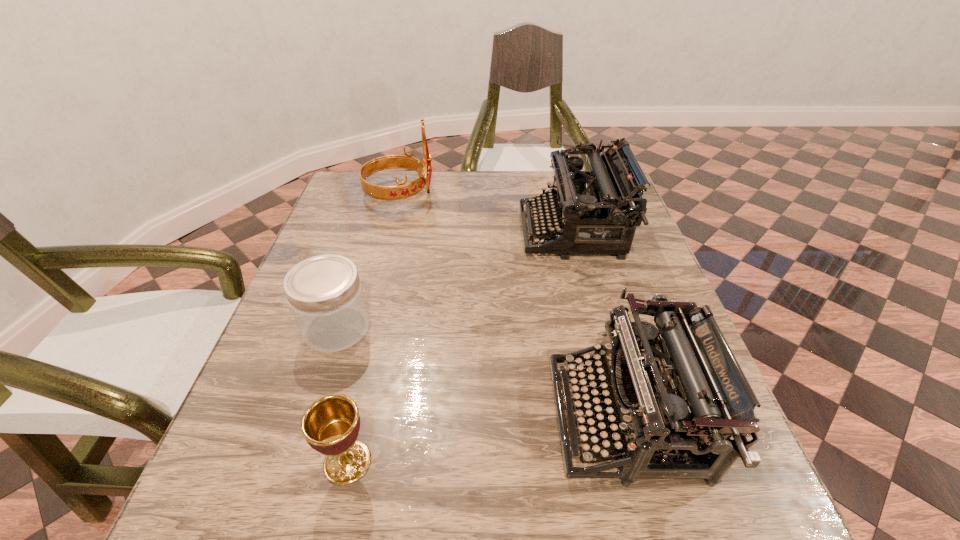
Locate an element on the screen. The height and width of the screenshot is (540, 960). tiara is located at coordinates (404, 190).

Image resolution: width=960 pixels, height=540 pixels. I want to click on the farther typewriter, so click(x=592, y=210).

Locate an element on the screen. This screenshot has width=960, height=540. the shorter typewriter is located at coordinates (685, 395).

Locate an element on the screen. The image size is (960, 540). the third shortest object is located at coordinates (685, 395).

At what (x,y) coordinates should I click in order to perform the action: click on jar. Please return your answer as a coordinate pair (x, y). The height and width of the screenshot is (540, 960). Looking at the image, I should click on (324, 292).

You are a GUI agent. You are given a task and a screenshot of the screen. Output one action in this format:
    pyautogui.click(x=<x>, y=<y>)
    Task: Click on the chalice
    This screenshot has height=540, width=960.
    Given the screenshot: What is the action you would take?
    pyautogui.click(x=330, y=425)

The width and height of the screenshot is (960, 540). I want to click on free point located 0.210m on the front-facing side of the tiara, so click(x=508, y=193).

Image resolution: width=960 pixels, height=540 pixels. What are the coordinates of `free space located 0.070m on the keyboard of the taller typewriter` in the screenshot? It's located at (493, 232).

You are a GUI agent. You are given a task and a screenshot of the screen. Output one action in this format:
    pyautogui.click(x=<x>, y=<y>)
    Task: Click on the vacant space situated 0.270m on the keyboard of the taller typewriter
    
    Given the screenshot: What is the action you would take?
    pyautogui.click(x=416, y=232)

Where is `vacant region located 0.400m on the keyboard of the taller typewriter`? The height and width of the screenshot is (540, 960). vacant region located 0.400m on the keyboard of the taller typewriter is located at coordinates (366, 232).